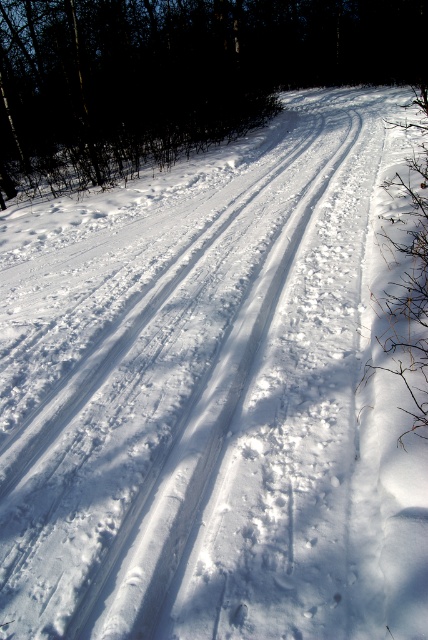
Which is in front, point (127, 42) or point (398, 225)?

Point (398, 225)

Does brown wood tree at upper left appear on the right side of brown textured branch at right?

No, brown wood tree at upper left is not to the right of brown textured branch at right.

Is point (101, 54) more distant than point (398, 227)?

Yes, point (101, 54) is farther from viewer.

Find the location of a particular element. brown wood tree at upper left is located at coordinates (177, 74).